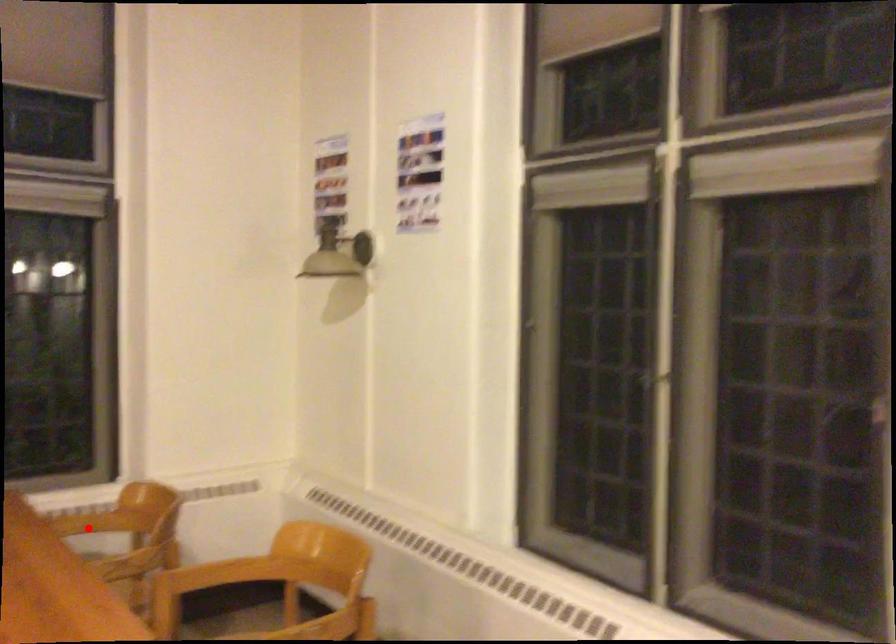
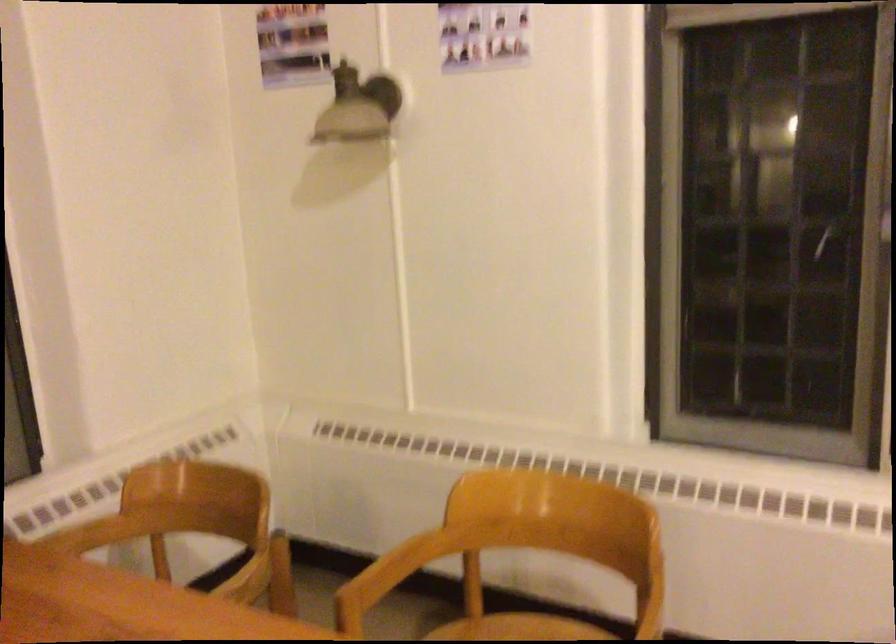
Question: I am providing you with two images of the same scene from different viewpoints. A red point is shown in image1. For the corresponding object point in image2, is it positioned nearer or farther from the camera?

Choices:
 (A) Nearer
 (B) Farther

Answer: (A)